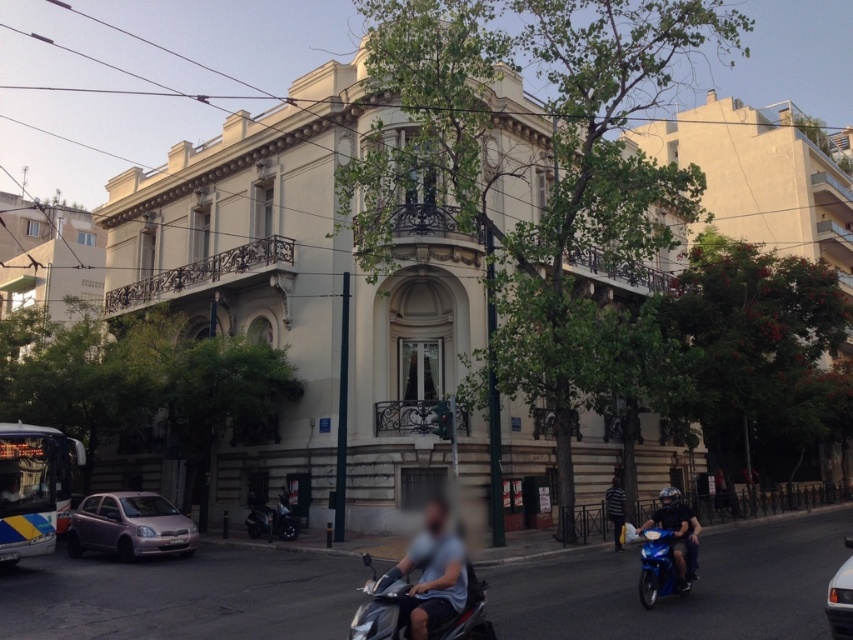
You are standing on the street looking at the large ornate building. There are two points marked on the ground in front of you at coordinates point [107,524] and point [396,621]. Which point is closer to you?

Result: Point [107,524] is closer to you because it is further to the viewer than point [396,621].

Consider the image. You are standing on the street looking at the large ornate building. There are two points marked on the ground in front of you at coordinates point (x=276, y=529) and point (x=614, y=499). Which point is closer to you?

Point (x=276, y=529) is closer to you because it is further to the viewer than point (x=614, y=499).